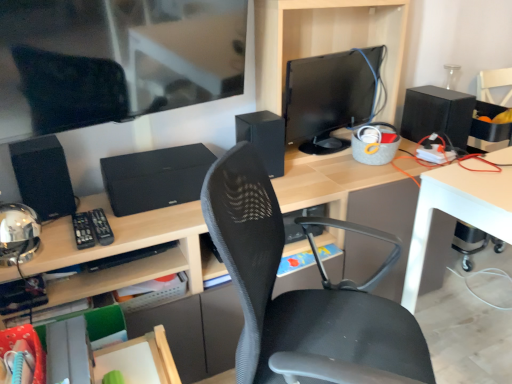
Question: Does black matte speaker at left, which appears as the first speaker when viewed from the left, have a smaller size compared to black textured speaker at center?

Choices:
 (A) no
 (B) yes

Answer: (B)

Question: Is black matte speaker at left, acting as the 3th speaker starting from the back, taller than black textured speaker at center?

Choices:
 (A) no
 (B) yes

Answer: (B)

Question: Would you say black matte speaker at left, which appears as the first speaker when viewed from the left, is outside black textured speaker at center?

Choices:
 (A) yes
 (B) no

Answer: (A)

Question: From the image's perspective, does black matte speaker at left, acting as the 3th speaker starting from the back, appear higher than black textured speaker at center?

Choices:
 (A) no
 (B) yes

Answer: (A)

Question: Does black matte speaker at left, the first speaker when ordered from front to back, appear on the left side of black textured speaker at center?

Choices:
 (A) no
 (B) yes

Answer: (B)

Question: Is black matte speaker at left, the first speaker when ordered from front to back, behind black textured speaker at center?

Choices:
 (A) yes
 (B) no

Answer: (B)

Question: From the image's perspective, does black textured speaker at center appear higher than black matte speaker at right, which ranks as the 3th speaker in front-to-back order?

Choices:
 (A) no
 (B) yes

Answer: (A)

Question: From the image's perspective, would you say black textured speaker at center is shown under black matte speaker at right, acting as the first speaker starting from the right?

Choices:
 (A) yes
 (B) no

Answer: (A)

Question: Is black textured speaker at center at the right side of black matte speaker at right, the 3th speaker viewed from the left?

Choices:
 (A) no
 (B) yes

Answer: (A)

Question: Considering the relative positions of black textured speaker at center and black matte speaker at right, acting as the first speaker starting from the right, in the image provided, is black textured speaker at center to the left of black matte speaker at right, acting as the first speaker starting from the right, from the viewer's perspective?

Choices:
 (A) yes
 (B) no

Answer: (A)

Question: Is black textured speaker at center outside of black matte speaker at right, the 3th speaker viewed from the left?

Choices:
 (A) yes
 (B) no

Answer: (A)

Question: Is black textured speaker at center smaller than black matte speaker at right, which is the 1th speaker in back-to-front order?

Choices:
 (A) no
 (B) yes

Answer: (A)

Question: Is black textured speaker at center further to camera compared to black matte speaker at center, the 2th speaker from the left?

Choices:
 (A) yes
 (B) no

Answer: (B)